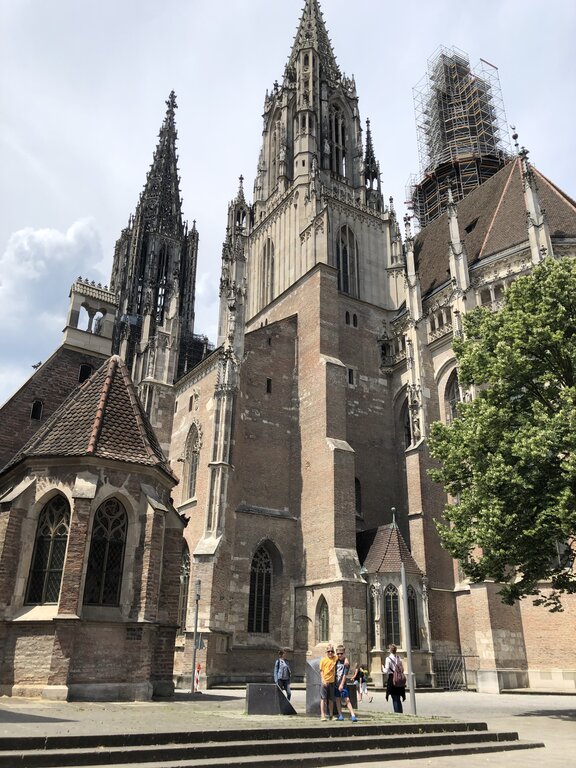
Identify the location of window. (257, 596).